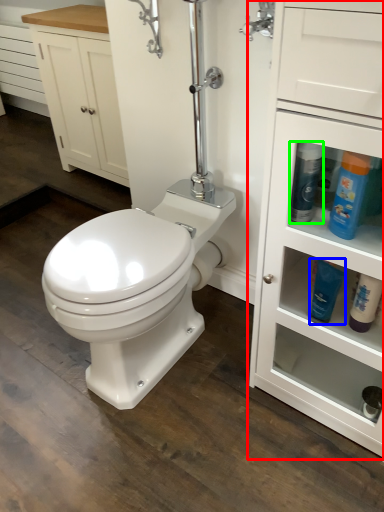
Question: Estimate the real-world distances between objects in this image. Which object is farther from bathroom cabinet (highlighted by a red box), cleaning product (highlighted by a blue box) or cleaning product (highlighted by a green box)?

Choices:
 (A) cleaning product
 (B) cleaning product

Answer: (B)